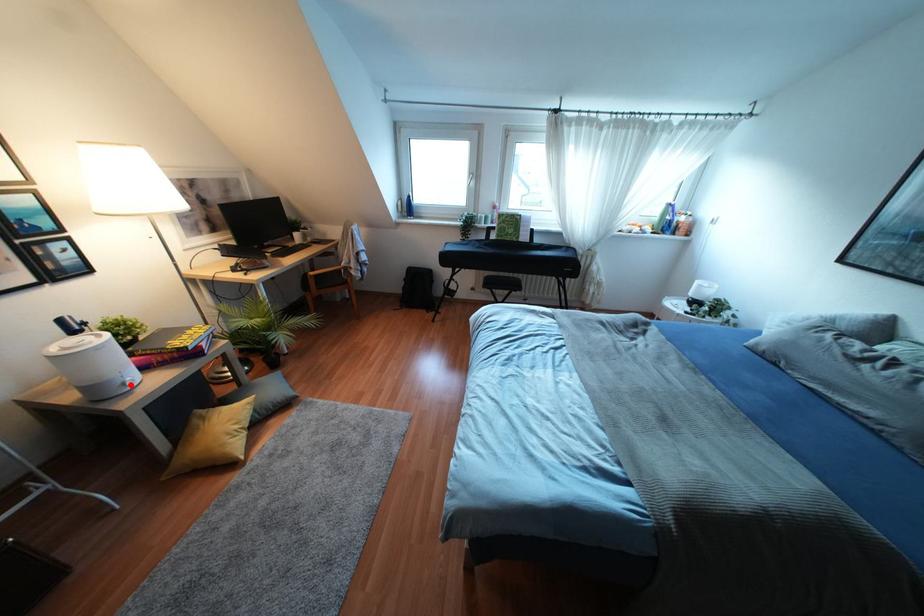
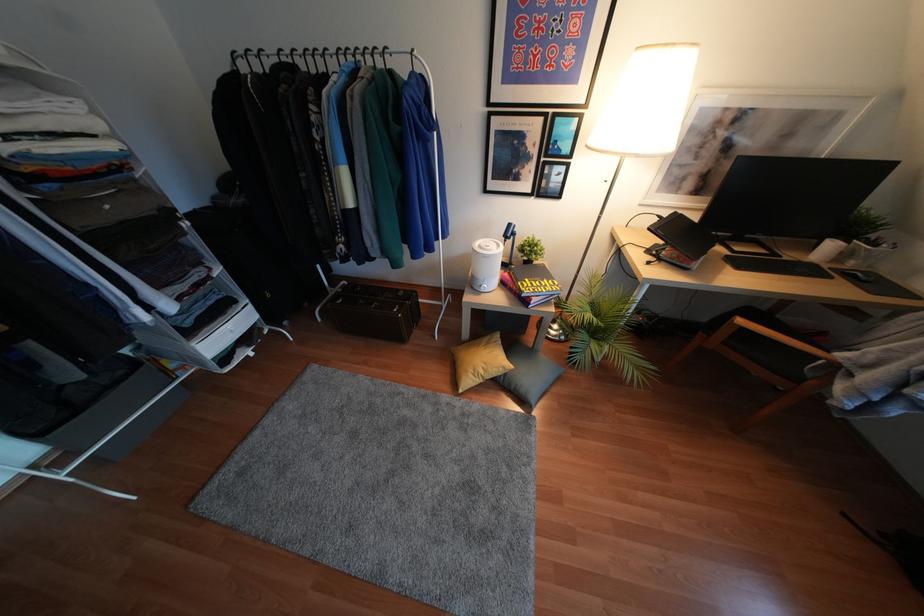
Locate, in the second image, the point that corresponds to the highlighted location in the first image.

(481, 290)